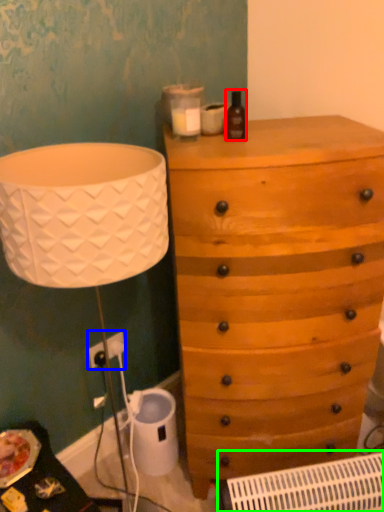
Question: Which is nearer to the bottle (highlighted by a red box)? electric outlet (highlighted by a blue box) or air conditioning (highlighted by a green box).

Choices:
 (A) electric outlet
 (B) air conditioning

Answer: (A)